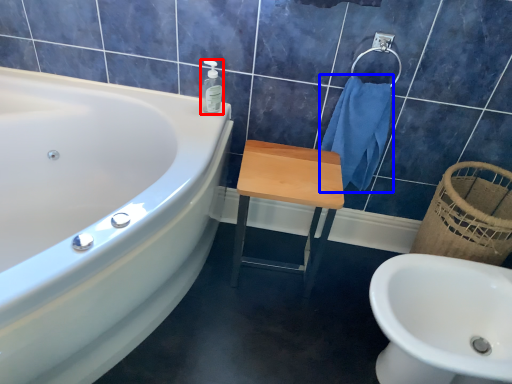
Question: Which object is further to the camera taking this photo, soap dispenser (highlighted by a red box) or bath towel (highlighted by a blue box)?

Choices:
 (A) soap dispenser
 (B) bath towel

Answer: (A)